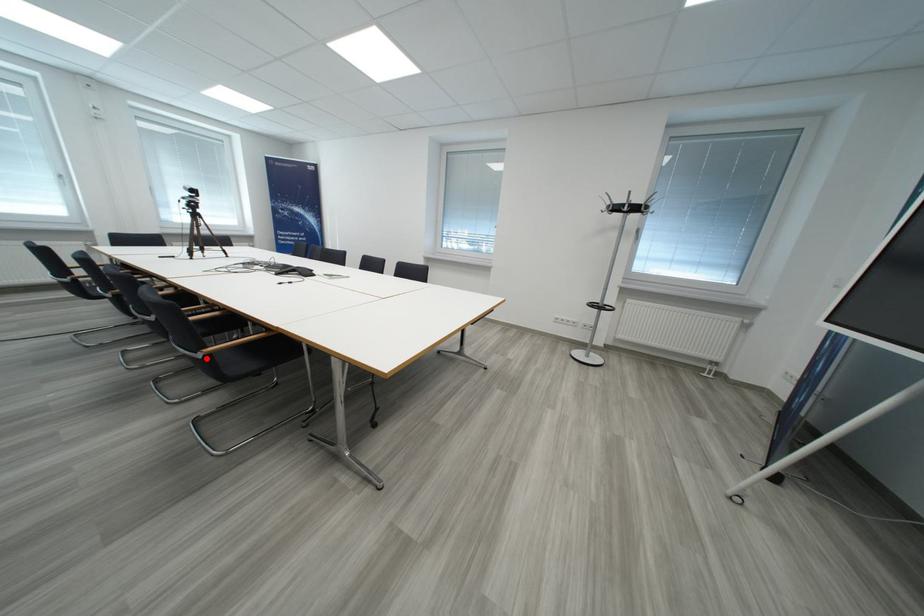
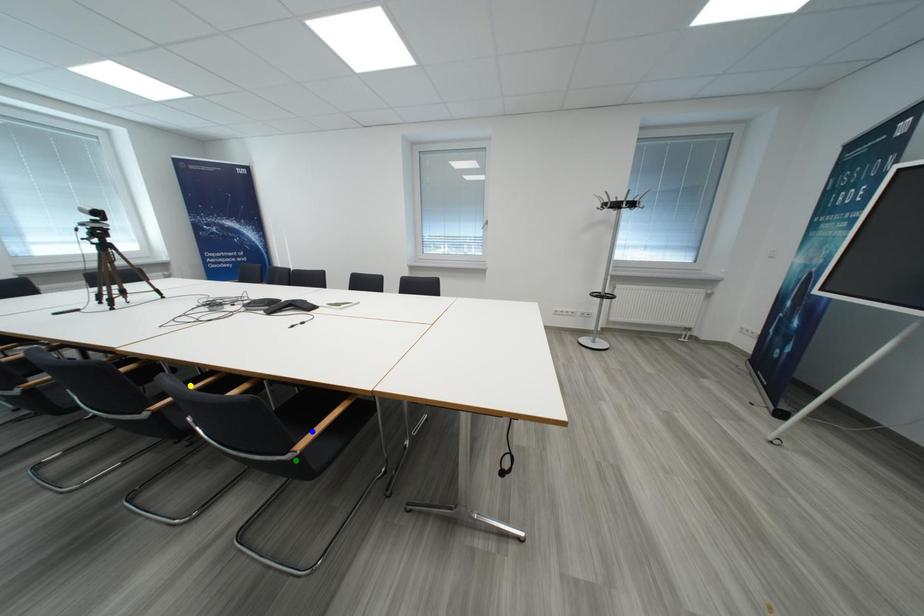
Question: I am providing you with two images of the same scene from different viewpoints. A red point is marked on the first image. You are given multiple points on the second image. Can you choose the point in image 2 that corresponds to the point in image 1?

Choices:
 (A) green point
 (B) yellow point
 (C) blue point

Answer: (A)